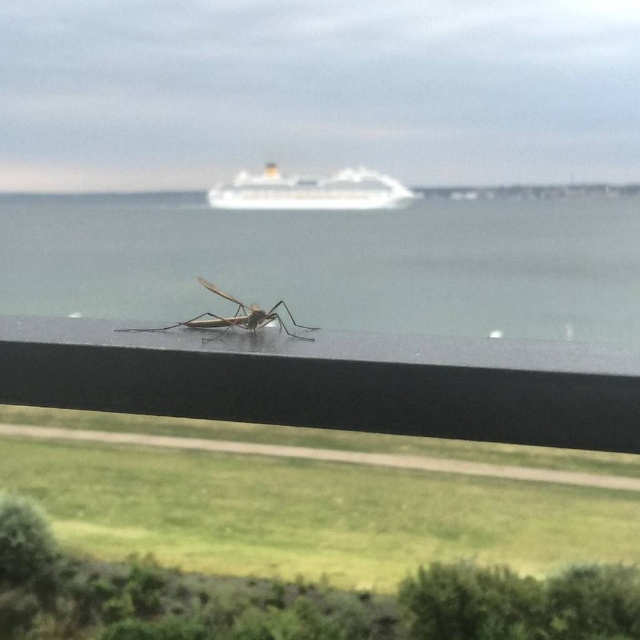
Which is above, clear glass water at center or white glossy ship at upper center?

Positioned higher is white glossy ship at upper center.

Between point (577, 272) and point (232, 189), which one is positioned behind?

The point (232, 189) is more distant.

Does point (317, 248) come farther from viewer compared to point (364, 173)?

No, it is in front of (364, 173).

Locate an element on the screen. Image resolution: width=640 pixels, height=640 pixels. clear glass water at center is located at coordinates (333, 262).

Between point (289, 301) and point (243, 314), which one is positioned behind?

The point (289, 301) is behind.

What do you see at coordinates (333, 262) in the screenshot? I see `clear glass water at center` at bounding box center [333, 262].

The height and width of the screenshot is (640, 640). What are the coordinates of `clear glass water at center` in the screenshot? It's located at (333, 262).

From the picture: Is white glossy ship at upper center taller than translucent brown mosquito at center?

No.

Does white glossy ship at upper center lie behind translucent brown mosquito at center?

That is True.

The height and width of the screenshot is (640, 640). Describe the element at coordinates (308, 189) in the screenshot. I see `white glossy ship at upper center` at that location.

In order to click on white glossy ship at upper center in this screenshot , I will do `click(308, 189)`.